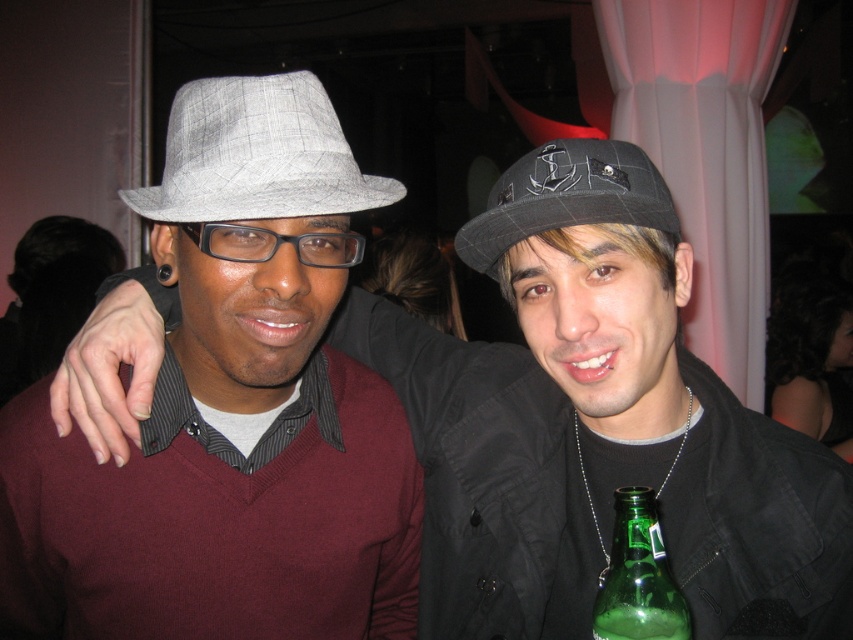
Question: Which of the following is the closest to the observer?

Choices:
 (A) green glass bottle at lower right
 (B) gray plaid fedora at upper left
 (C) plaid fabric fedora at center
 (D) matte gray hat at center

Answer: (A)

Question: Can you confirm if matte gray hat at center is smaller than plaid fabric fedora at center?

Choices:
 (A) no
 (B) yes

Answer: (A)

Question: Does gray plaid fedora at upper left have a greater width compared to plaid fabric fedora at center?

Choices:
 (A) no
 (B) yes

Answer: (B)

Question: Which point is farther to the camera?

Choices:
 (A) (289, 177)
 (B) (659, 616)

Answer: (A)

Question: In this image, where is matte gray hat at center located relative to gray plaid fedora at upper left?

Choices:
 (A) right
 (B) left

Answer: (A)

Question: Among these points, which one is farthest from the camera?

Choices:
 (A) (763, 442)
 (B) (343, 200)
 (C) (616, 602)
 (D) (672, 234)

Answer: (A)